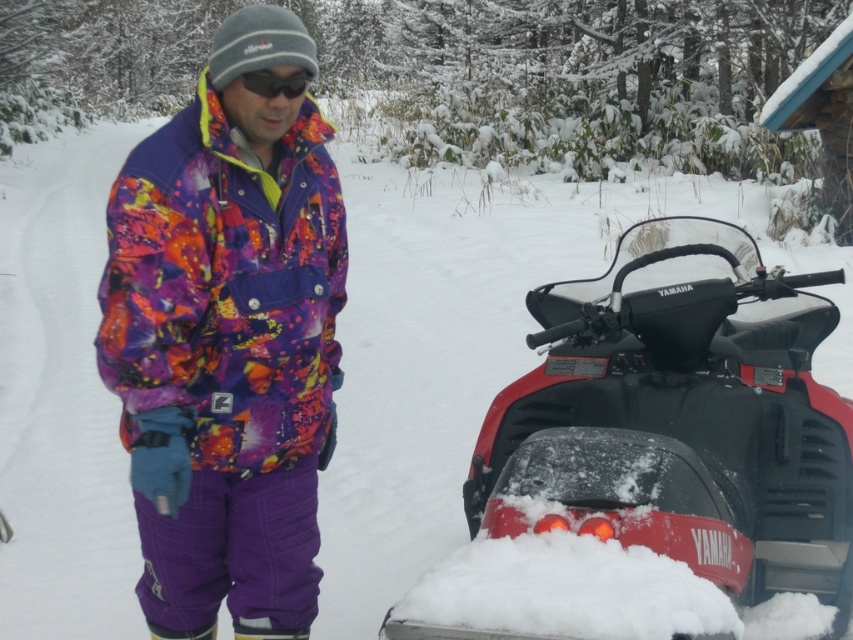
Question: Among these objects, which one is farthest from the camera?

Choices:
 (A) purple synthetic ski boot at lower center
 (B) floral-patterned jacket at center
 (C) red matte snowmobile at lower right

Answer: (A)

Question: Which object is closer to the camera taking this photo?

Choices:
 (A) matte purple ski boot at lower center
 (B) floral-patterned jacket at center

Answer: (B)

Question: Where is red matte snowmobile at lower right located in relation to matte purple ski boot at lower center in the image?

Choices:
 (A) left
 (B) right

Answer: (B)

Question: Does matte purple ski boot at lower center lie in front of purple synthetic ski boot at lower center?

Choices:
 (A) yes
 (B) no

Answer: (A)

Question: Which object is positioned closest to the red matte snowmobile at lower right?

Choices:
 (A) floral-patterned jacket at center
 (B) matte purple ski boot at lower center

Answer: (A)

Question: Does red matte snowmobile at lower right appear on the right side of purple synthetic ski boot at lower center?

Choices:
 (A) no
 (B) yes

Answer: (B)